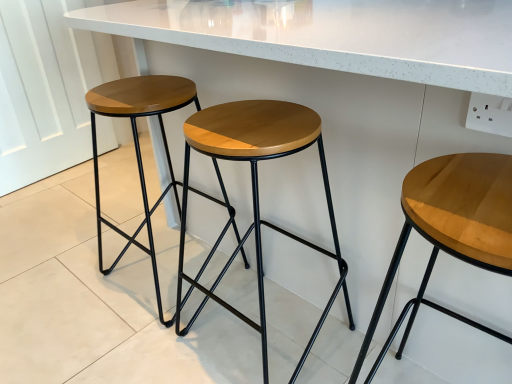
Locate an element on the screen. This screenshot has width=512, height=384. vacant region above light brown wood stool at center, acting as the 1th stool starting from the right (from a real-world perspective) is located at coordinates (460, 189).